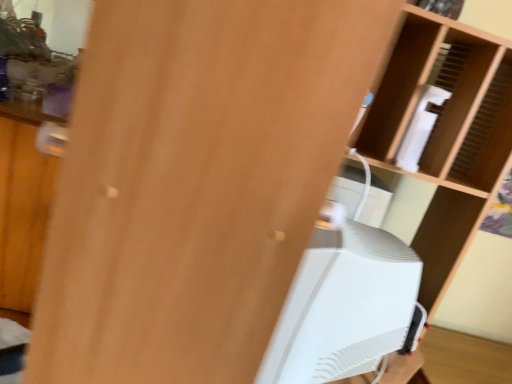
You are a GUI agent. You are given a task and a screenshot of the screen. Output one action in this format:
    pyautogui.click(x=<x>, y=<y>)
    Task: Click on the matte wood screen door at center
    Image resolution: width=512 pixels, height=384 pixels.
    Given the screenshot: What is the action you would take?
    click(195, 182)

Image resolution: width=512 pixels, height=384 pixels. What do you see at coordinates (195, 182) in the screenshot? I see `matte wood screen door at center` at bounding box center [195, 182].

Identify the location of matte wood screen door at center. (195, 182).